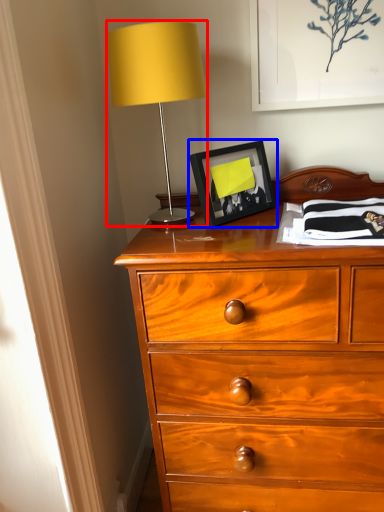
Question: Which of the following is the closest to the observer, table lamp (highlighted by a red box) or picture frame (highlighted by a blue box)?

Choices:
 (A) table lamp
 (B) picture frame

Answer: (A)